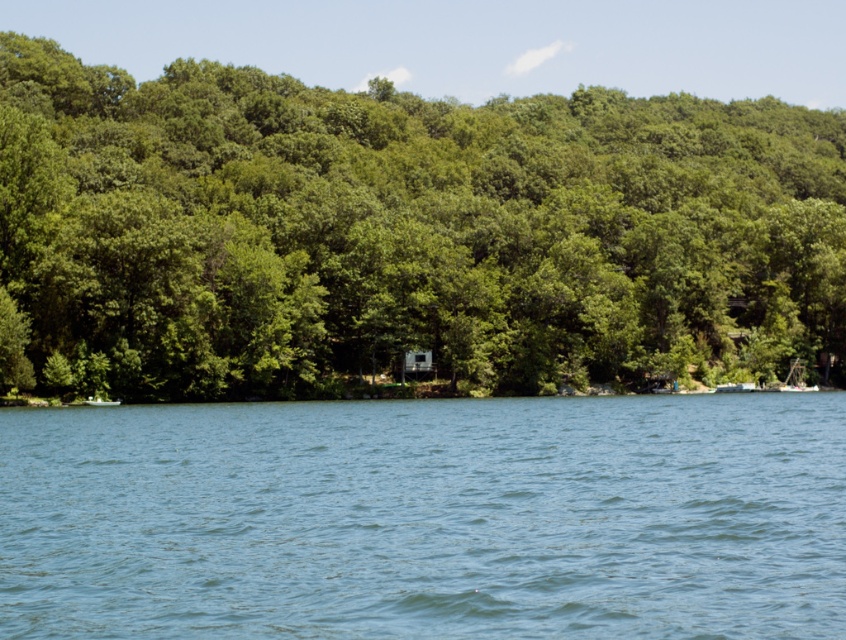
Can you confirm if green leafy tree at center is positioned to the left of blue liquid water at center?

No, green leafy tree at center is not to the left of blue liquid water at center.

Locate an element on the screen. This screenshot has height=640, width=846. green leafy tree at center is located at coordinates (404, 234).

Where is `green leafy tree at center`? The height and width of the screenshot is (640, 846). green leafy tree at center is located at coordinates (404, 234).